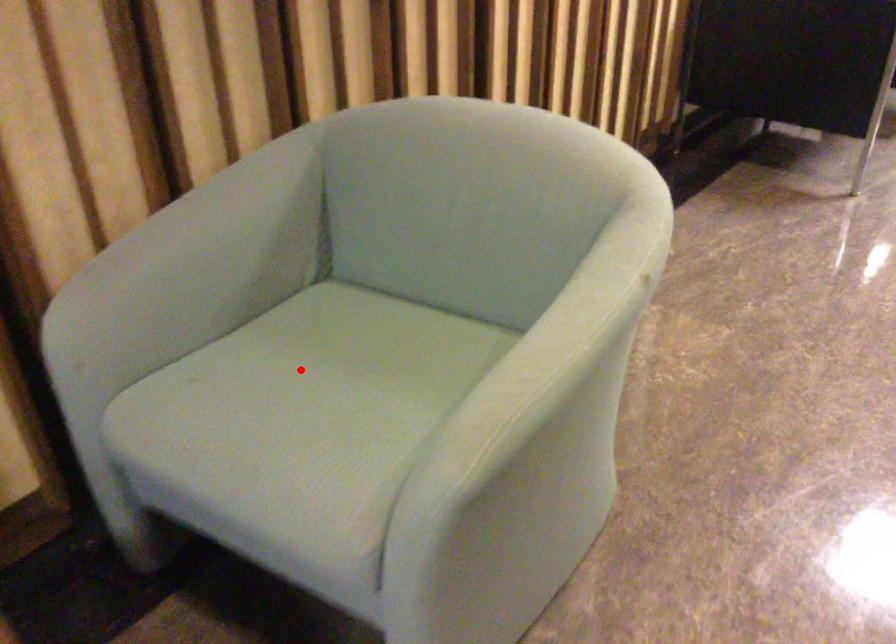
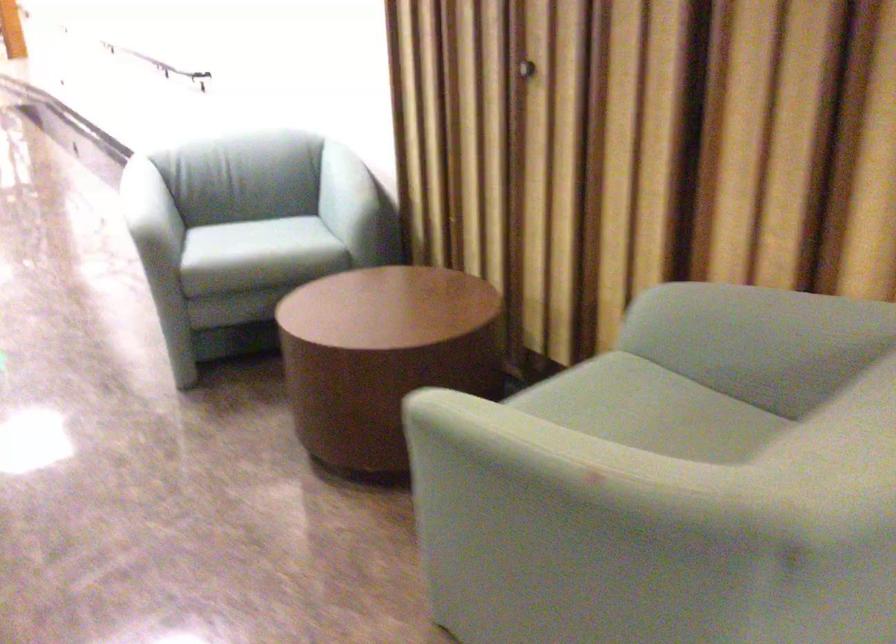
Question: I am providing you with two images of the same scene from different viewpoints. A red point is shown in image1. For the corresponding object point in image2, is it positioned nearer or farther from the camera?

Choices:
 (A) Nearer
 (B) Farther

Answer: (B)